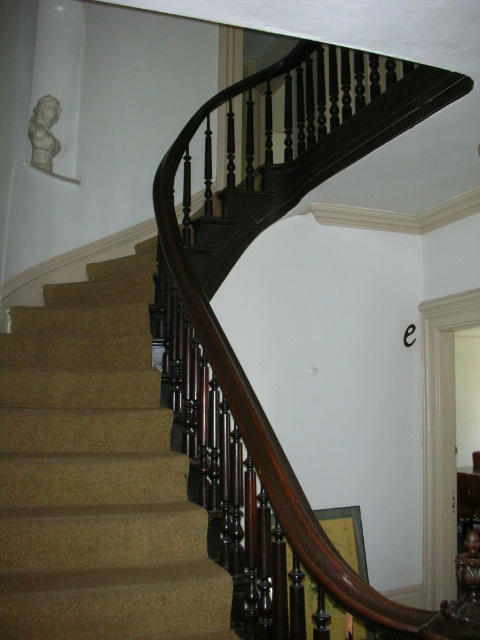
Is dark wood baluster at center above white marble bust at upper left?

Incorrect, dark wood baluster at center is not positioned above white marble bust at upper left.

What do you see at coordinates (230, 346) in the screenshot? Image resolution: width=480 pixels, height=640 pixels. I see `dark wood baluster at center` at bounding box center [230, 346].

Does point (179, 381) come in front of point (51, 154)?

Yes, it is in front of point (51, 154).

Where is `dark wood baluster at center`? The image size is (480, 640). dark wood baluster at center is located at coordinates (230, 346).

Is carpeted stairs at center further to camera compared to white marble bust at upper left?

No.

Which is more to the left, carpeted stairs at center or white marble bust at upper left?

Positioned to the left is white marble bust at upper left.

Between point (168, 449) and point (37, 116), which one is positioned behind?

Positioned behind is point (37, 116).

You are a GUI agent. You are given a task and a screenshot of the screen. Output one action in this format:
    pyautogui.click(x=<x>, y=<y>)
    Task: Click on the carpeted stairs at center
    
    Given the screenshot: What is the action you would take?
    pyautogui.click(x=96, y=474)

Can you confirm if dark wood baluster at center is positioned below carpeted stairs at center?

No.

Does dark wood baluster at center come behind carpeted stairs at center?

That is False.

The image size is (480, 640). Identify the location of dark wood baluster at center. (230, 346).

The width and height of the screenshot is (480, 640). Find the location of `dark wood baluster at center`. dark wood baluster at center is located at coordinates (230, 346).